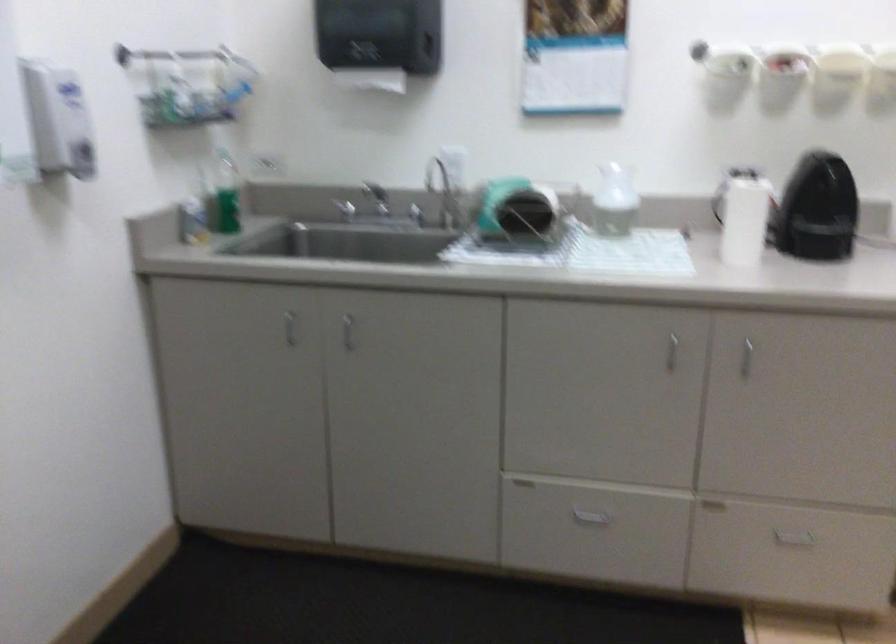
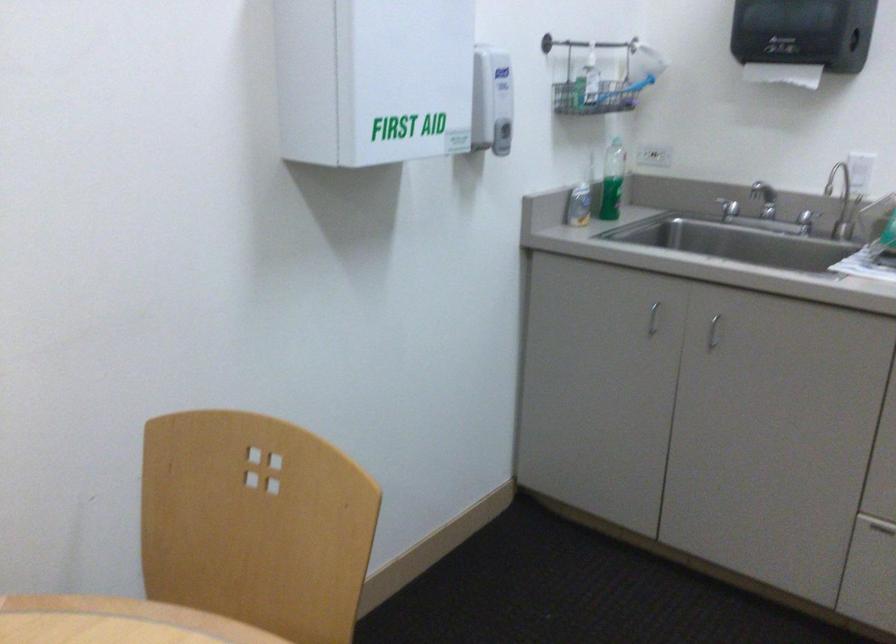
Locate, in the second image, the point that corresponds to [285,327] in the first image.

(652, 319)